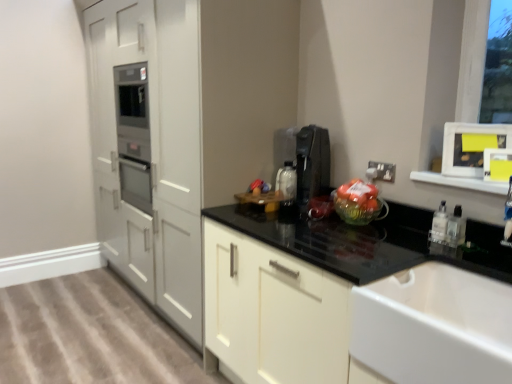
Question: Considering the positions of clear plastic bottle at right, which is the 2th bottle from right to left, and white plastic electric outlet at upper right in the image, is clear plastic bottle at right, which is the 2th bottle from right to left, wider or thinner than white plastic electric outlet at upper right?

Choices:
 (A) thin
 (B) wide

Answer: (B)

Question: Is clear plastic bottle at right, which is the 2th bottle from right to left, situated inside white plastic electric outlet at upper right or outside?

Choices:
 (A) outside
 (B) inside

Answer: (A)

Question: Which of these objects is positioned closest to the translucent plastic bag of oranges at center-right?

Choices:
 (A) black plastic coffee machine at upper right
 (B) black glossy countertop at center
 (C) translucent glass bowl at center
 (D) white glossy sink at lower right
 (E) clear plastic bottle at lower right, which is the second bottle from left to right

Answer: (C)

Question: Which object is the closest to the translucent plastic bag of oranges at center-right?

Choices:
 (A) white glossy sink at lower right
 (B) clear plastic bottle at right, which is the 2th bottle from right to left
 (C) clear plastic bottle at lower right, the first bottle viewed from the right
 (D) black glossy countertop at center
 (E) white plastic electric outlet at upper right

Answer: (E)